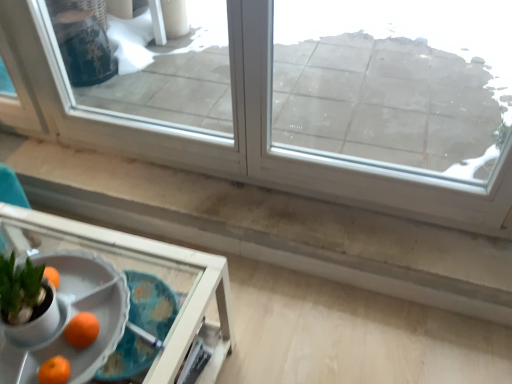
Question: Is white plastic tray at lower left next to transparent glass window at upper center, which appears as the first window when viewed from the right, and touching it?

Choices:
 (A) no
 (B) yes

Answer: (A)

Question: Is the position of white plastic tray at lower left more distant than that of transparent glass window at upper center, which appears as the first window when viewed from the right?

Choices:
 (A) yes
 (B) no

Answer: (B)

Question: Considering the relative sizes of white plastic tray at lower left and transparent glass window at upper center, the second window positioned from the left, in the image provided, is white plastic tray at lower left smaller than transparent glass window at upper center, the second window positioned from the left,?

Choices:
 (A) no
 (B) yes

Answer: (A)

Question: Could transparent glass window at upper center, which appears as the first window when viewed from the right, be considered to be inside white plastic tray at lower left?

Choices:
 (A) yes
 (B) no

Answer: (B)

Question: Considering the relative positions of white plastic tray at lower left and transparent glass window at upper center, which appears as the first window when viewed from the right, in the image provided, is white plastic tray at lower left to the left of transparent glass window at upper center, which appears as the first window when viewed from the right, from the viewer's perspective?

Choices:
 (A) no
 (B) yes

Answer: (B)

Question: Considering the positions of transparent glass window at upper center, the second window positioned from the left, and transparent glass window at upper center, the second window from the right, in the image, is transparent glass window at upper center, the second window positioned from the left, taller or shorter than transparent glass window at upper center, the second window from the right,?

Choices:
 (A) short
 (B) tall

Answer: (A)

Question: From the image's perspective, is transparent glass window at upper center, the second window positioned from the left, above or below transparent glass window at upper center, the 1th window positioned from the left?

Choices:
 (A) below
 (B) above

Answer: (A)

Question: Considering the positions of point (276, 1) and point (74, 130), is point (276, 1) closer or farther from the camera than point (74, 130)?

Choices:
 (A) farther
 (B) closer

Answer: (A)

Question: Considering the relative positions of transparent glass window at upper center, which appears as the first window when viewed from the right, and transparent glass window at upper center, the 1th window positioned from the left, in the image provided, is transparent glass window at upper center, which appears as the first window when viewed from the right, to the left or to the right of transparent glass window at upper center, the 1th window positioned from the left,?

Choices:
 (A) left
 (B) right

Answer: (B)

Question: Is transparent glass window at upper center, the 1th window positioned from the left, bigger or smaller than white plastic tray at lower left?

Choices:
 (A) small
 (B) big

Answer: (A)

Question: Would you say transparent glass window at upper center, the second window from the right, is to the left or to the right of white plastic tray at lower left in the picture?

Choices:
 (A) left
 (B) right

Answer: (B)

Question: Which is correct: transparent glass window at upper center, the 1th window positioned from the left, is inside white plastic tray at lower left, or outside of it?

Choices:
 (A) outside
 (B) inside

Answer: (A)

Question: From a real-world perspective, relative to white plastic tray at lower left, is transparent glass window at upper center, the second window from the right, vertically above or below?

Choices:
 (A) above
 (B) below

Answer: (A)

Question: Which is correct: orange matte at lower left is inside transparent glass window at upper center, the second window from the right, or outside of it?

Choices:
 (A) outside
 (B) inside

Answer: (A)

Question: Considering the positions of orange matte at lower left and transparent glass window at upper center, the 1th window positioned from the left, in the image, is orange matte at lower left taller or shorter than transparent glass window at upper center, the 1th window positioned from the left,?

Choices:
 (A) short
 (B) tall

Answer: (A)